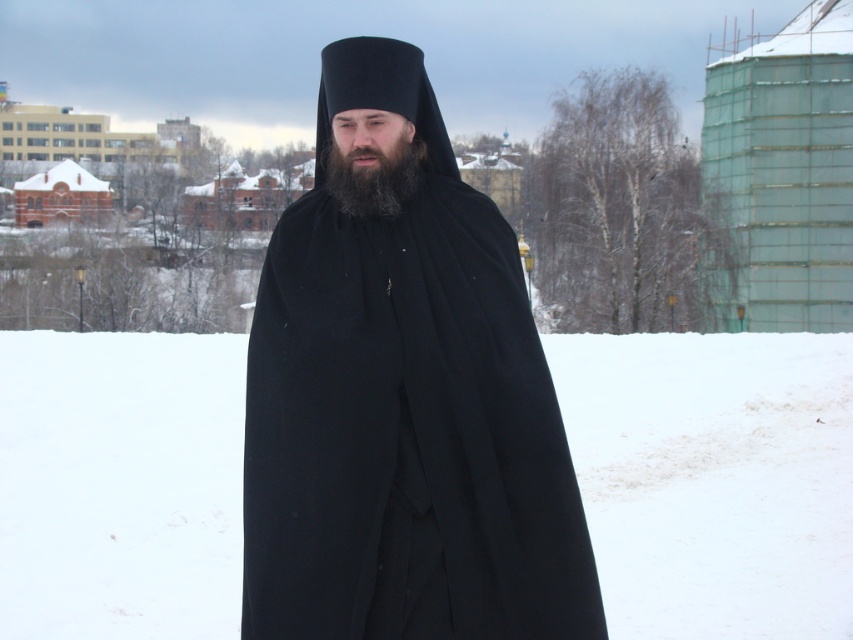
You are a photographer trying to capture the figure in the scene. Since the black woolen robe at center and the black matte beard at center are both dark, how can you ensure that the robe stands out more in your photo?

The black woolen robe at center is much taller as black matte beard at center, so adjusting the focus or lighting to emphasize the height difference will make the robe stand out more.

You are a photographer trying to capture the figure in the snowy scene. Since the black woolen robe at center and the black matte beard at center are both dark, which one do you think will appear more prominent in the photo due to its size?

The black woolen robe at center might be wider than black matte beard at center, so the robe will likely appear more prominent in the photo due to its larger size compared to the beard.

You are a photographer trying to capture the black woolen robe at center and the white fluffy snow at center in a single shot. Which object should you focus on first if you want to ensure both are in sharp focus?

The white fluffy snow at center is below the black woolen robe at center, so you should focus on the black woolen robe at center first since it is closer to the camera.